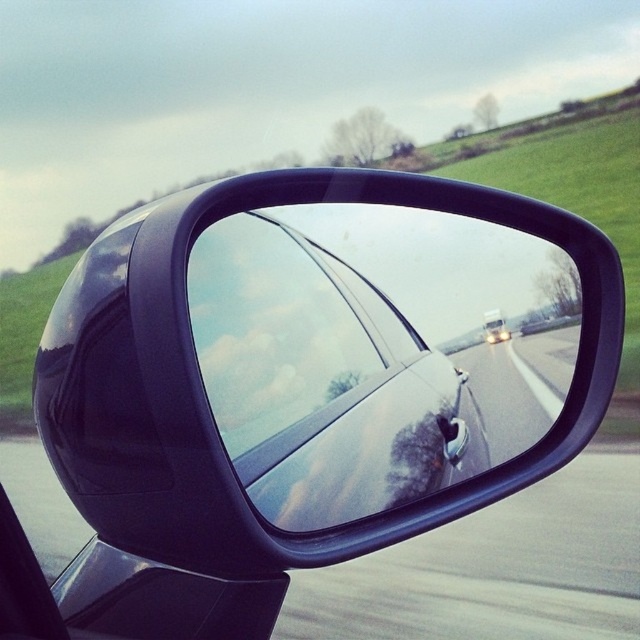
Question: Which of the following is the farthest from the observer?

Choices:
 (A) white glossy car at center
 (B) glossy asphalt road at center
 (C) glossy black mirror at center
 (D) transparent glass car window at center

Answer: (A)

Question: Considering the relative positions of transparent glass car window at center and white glossy car at center in the image provided, where is transparent glass car window at center located with respect to white glossy car at center?

Choices:
 (A) left
 (B) right

Answer: (A)

Question: Which of the following is the farthest from the observer?

Choices:
 (A) white glossy car at center
 (B) glossy asphalt road at center

Answer: (A)

Question: Can you confirm if transparent glass car window at center is positioned above white glossy car at center?

Choices:
 (A) no
 (B) yes

Answer: (A)

Question: Can you confirm if glossy black mirror at center is bigger than white glossy car at center?

Choices:
 (A) yes
 (B) no

Answer: (A)

Question: Among these objects, which one is farthest from the camera?

Choices:
 (A) white glossy car at center
 (B) glossy asphalt road at center

Answer: (A)